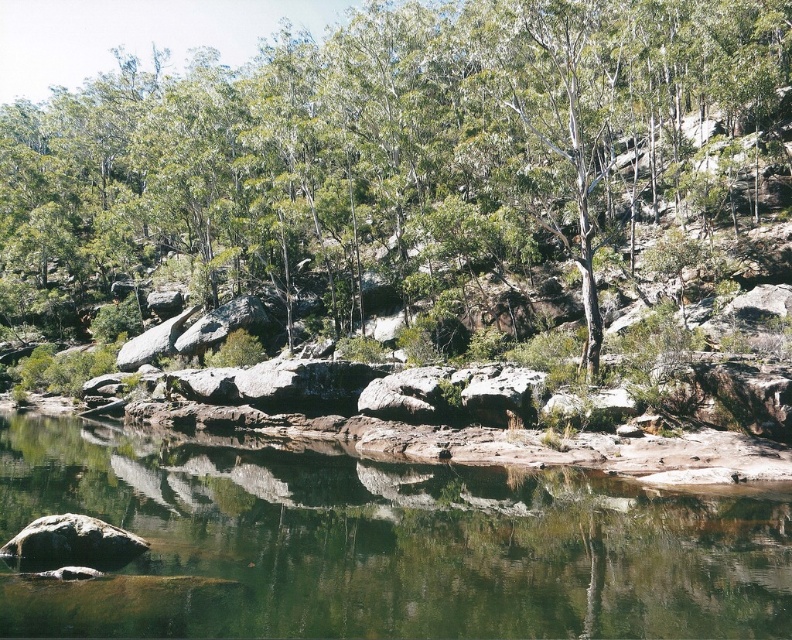
You are standing at the edge of the water and want to place a small floating toy in the clear water at center. To avoid it drifting towards the smooth gray rock at lower left, which direction should you place it?

The clear water at center is closer to the viewer than the smooth gray rock at lower left, so placing the toy towards the center would keep it away from the rock.

You are a hiker standing on the smooth gray rock at lower left and want to reach the green leafy tree at center. Which direction should you move to get closer to the tree?

To reach the green leafy tree at center from the smooth gray rock at lower left, you should move forward since the tree is further away from you compared to the rock.

You are standing at the point labeled point at coordinates (650, 102) and want to reach the opposite shore. The distance between your current position and the shore is 52.17 meters. Can you safely swim across if you know that the maximum distance you can swim is 50 meters?

The distance between the point at coordinates (650, 102) and the shore is 52.17 meters, which exceeds your maximum swimming distance of 50 meters. Therefore, you cannot safely swim across.